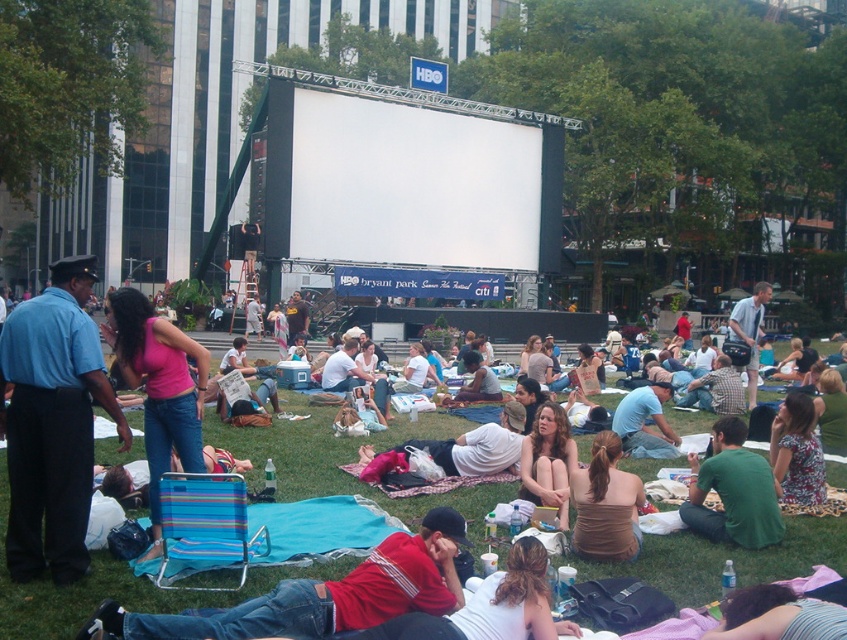
Who is more forward, [117,342] or [785,624]?

Point [785,624] is in front.

Is pink fabric top at center positioned in front of matte pink bikini top at lower right?

No, pink fabric top at center is further to the viewer.

The height and width of the screenshot is (640, 847). Describe the element at coordinates (159, 387) in the screenshot. I see `pink fabric top at center` at that location.

Locate an element on the screen. This screenshot has height=640, width=847. pink fabric top at center is located at coordinates (159, 387).

This screenshot has height=640, width=847. Describe the element at coordinates (734, 492) in the screenshot. I see `green cotton shirt at center` at that location.

Which is more to the left, green cotton shirt at center or matte blue shirt at center?

green cotton shirt at center is more to the left.

Describe the element at coordinates (734, 492) in the screenshot. I see `green cotton shirt at center` at that location.

What are the coordinates of `green cotton shirt at center` in the screenshot? It's located at (734, 492).

Who is higher up, red cotton shirt at center or floral dress at lower right?

Positioned higher is floral dress at lower right.

Does red cotton shirt at center have a lesser height compared to floral dress at lower right?

Yes, red cotton shirt at center is shorter than floral dress at lower right.

Is point (198, 624) positioned behind point (778, 412)?

No, it is not.

This screenshot has height=640, width=847. In order to click on red cotton shirt at center in this screenshot , I will do click(327, 593).